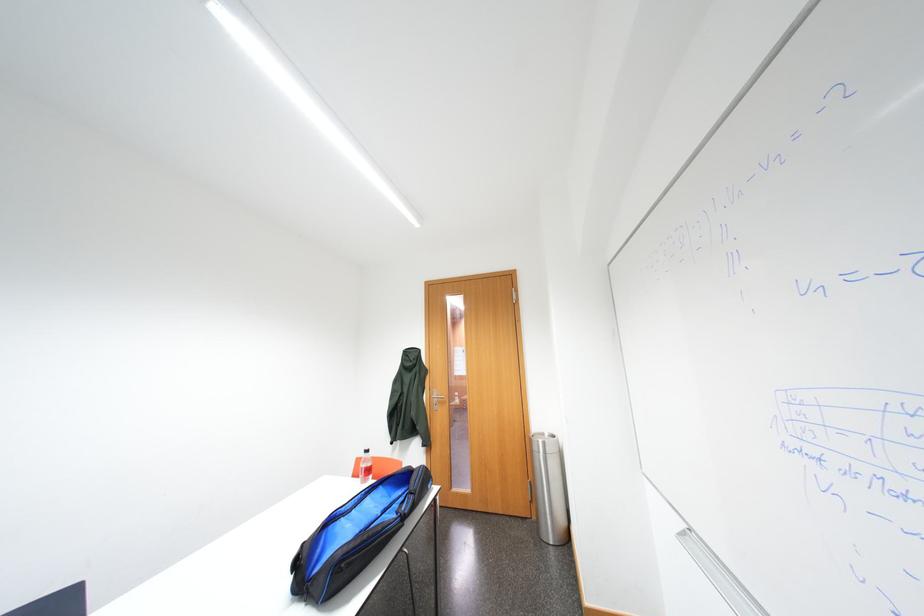
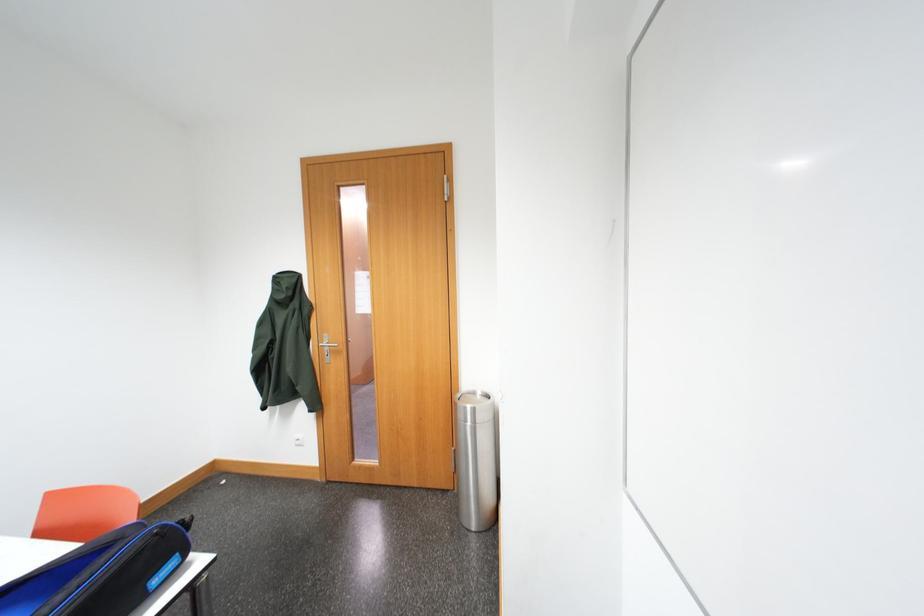
The images are taken continuously from a first-person perspective. In which direction are you moving?

The cameraman walked toward right, forward.